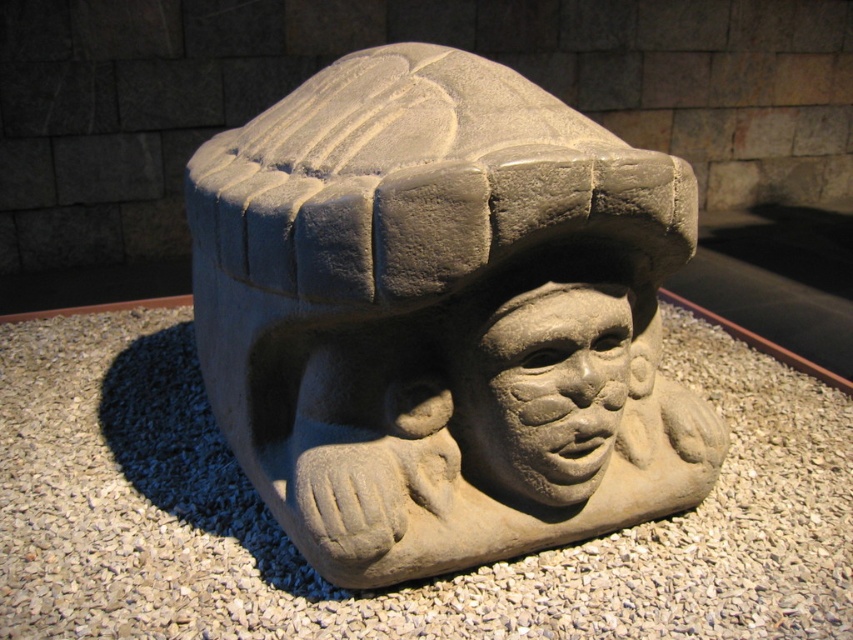
Is point (137, 598) less distant than point (567, 288)?

That is False.

Does point (183, 353) come in front of point (618, 296)?

That is False.

You are a GUI agent. You are given a task and a screenshot of the screen. Output one action in this format:
    pyautogui.click(x=<x>, y=<y>)
    Task: Click on the gray gravel at center
    
    Given the screenshot: What is the action you would take?
    pyautogui.click(x=407, y=582)

Does gray stone carving at center have a smaller size compared to gray gravel at center?

Correct, gray stone carving at center occupies less space than gray gravel at center.

Which is in front, point (440, 67) or point (44, 484)?

Point (440, 67) is more forward.

You are a GUI agent. You are given a task and a screenshot of the screen. Output one action in this format:
    pyautogui.click(x=<x>, y=<y>)
    Task: Click on the gray stone carving at center
    The width and height of the screenshot is (853, 640).
    Given the screenshot: What is the action you would take?
    pyautogui.click(x=442, y=316)

This screenshot has height=640, width=853. I want to click on gray stone carving at center, so click(x=442, y=316).

Is gray stone carving at center wider than gray stone face at center?

Yes, gray stone carving at center is wider than gray stone face at center.

Between point (625, 392) and point (579, 292), which one is positioned behind?

Point (625, 392)

The width and height of the screenshot is (853, 640). What do you see at coordinates (442, 316) in the screenshot?
I see `gray stone carving at center` at bounding box center [442, 316].

Where is `gray stone carving at center`? gray stone carving at center is located at coordinates click(x=442, y=316).